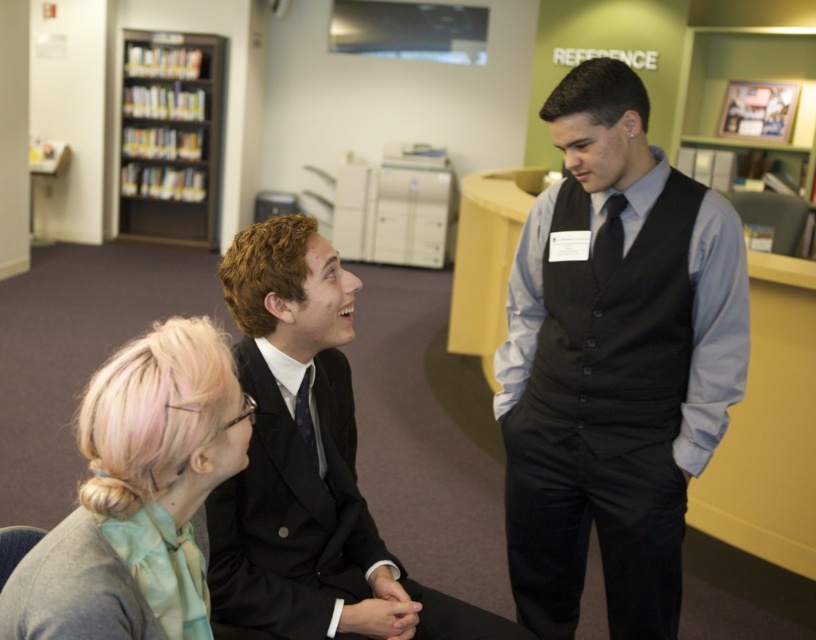
Question: Does matte black suit at center appear on the left side of black wood bookshelf at upper left?

Choices:
 (A) no
 (B) yes

Answer: (A)

Question: Can you confirm if matte black suit at center is positioned to the right of blonde hair at left?

Choices:
 (A) yes
 (B) no

Answer: (A)

Question: Does blonde hair at left have a lesser width compared to matte black tie at center?

Choices:
 (A) yes
 (B) no

Answer: (B)

Question: Which object is the farthest from the black satin tie at center?

Choices:
 (A) matte black vest at center
 (B) blonde hair at left
 (C) matte black suit at center
 (D) black wood bookshelf at upper left

Answer: (D)

Question: Which object is closer to the camera taking this photo?

Choices:
 (A) matte black vest at center
 (B) blonde hair at left
 (C) black satin tie at center

Answer: (B)

Question: Among these points, which one is farthest from the camera?

Choices:
 (A) (153, 80)
 (B) (653, 593)

Answer: (A)